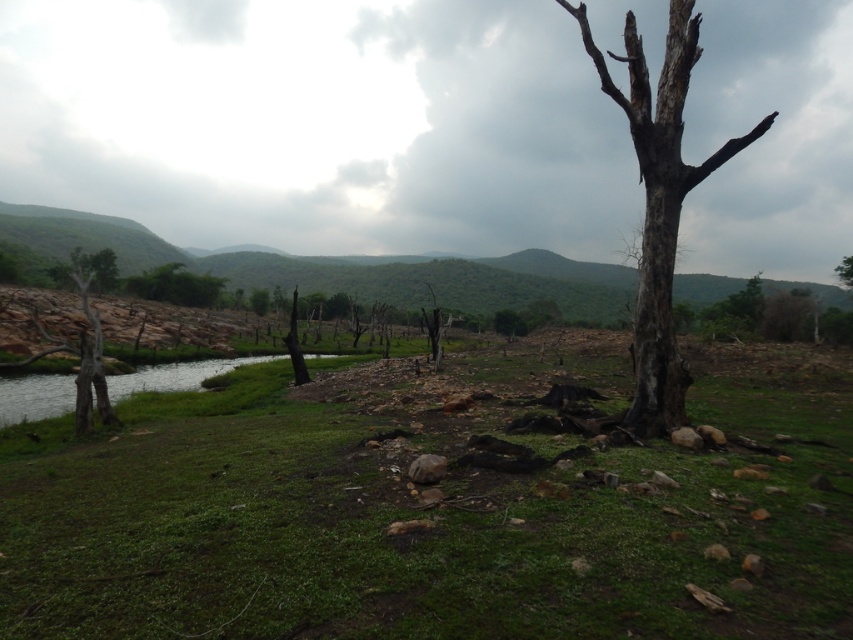
Does green grassy hillside at center come in front of green leafy bush at left?

Yes, green grassy hillside at center is closer to the viewer.

Consider the image. Does green grassy hillside at center have a larger size compared to green leafy bush at left?

Indeed, green grassy hillside at center has a larger size compared to green leafy bush at left.

Find the location of a particular element. The image size is (853, 640). green grassy hillside at center is located at coordinates (343, 268).

Does green grassy hillside at center appear on the left side of brown rough tree at center?

Yes, green grassy hillside at center is to the left of brown rough tree at center.

Can you confirm if green grassy hillside at center is positioned below brown rough tree at center?

No, green grassy hillside at center is not below brown rough tree at center.

Is point (494, 269) positioned before point (511, 312)?

No, it is behind (511, 312).

Identify the location of green grassy hillside at center. Image resolution: width=853 pixels, height=640 pixels. (343, 268).

This screenshot has width=853, height=640. Describe the element at coordinates (431, 513) in the screenshot. I see `green grassy at center` at that location.

In the scene shown: Between green grassy at center and brown rough tree at right, which one appears on the right side from the viewer's perspective?

brown rough tree at right is more to the right.

Locate an element on the screen. green grassy at center is located at coordinates (431, 513).